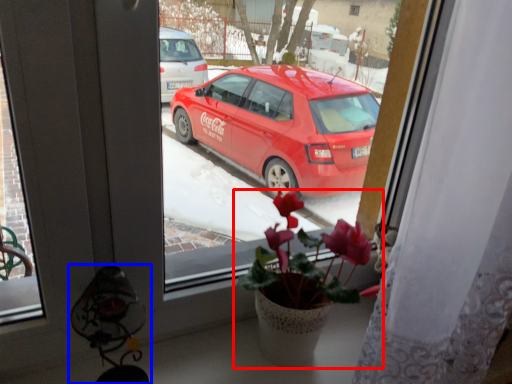
Question: Which point is further to the camera, houseplant (highlighted by a red box) or lamp (highlighted by a blue box)?

Choices:
 (A) houseplant
 (B) lamp

Answer: (A)